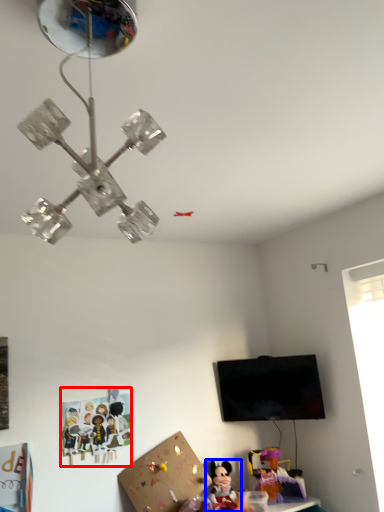
Question: Among these objects, which one is nearest to the camera, toy (highlighted by a red box) or toy (highlighted by a blue box)?

Choices:
 (A) toy
 (B) toy

Answer: (B)